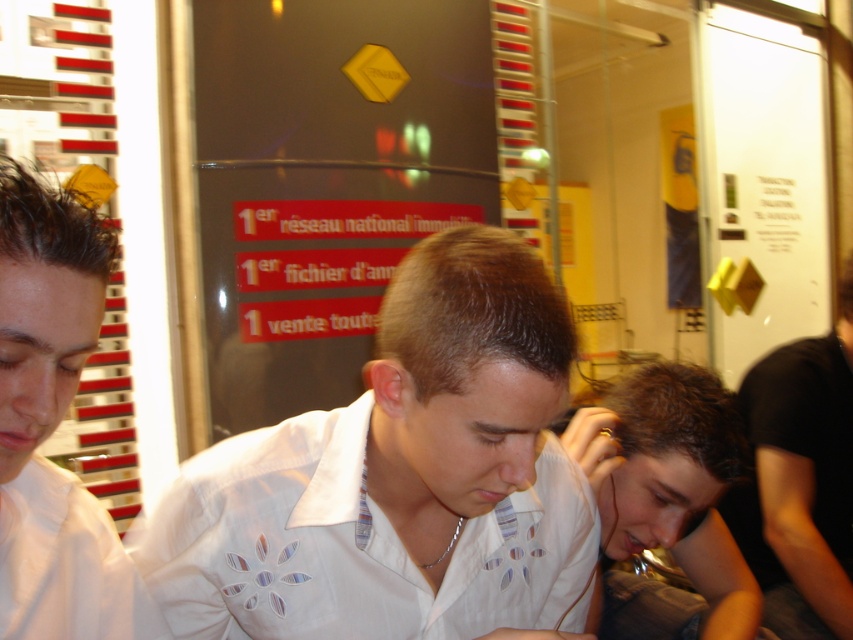
Question: Can you confirm if white fabric shirt at center is smaller than white matte shirt at left?

Choices:
 (A) no
 (B) yes

Answer: (A)

Question: Does white fabric shirt at center appear over black matte shirt at right?

Choices:
 (A) no
 (B) yes

Answer: (B)

Question: Can you confirm if dark brown hair at lower right is smaller than black matte shirt at right?

Choices:
 (A) yes
 (B) no

Answer: (A)

Question: Which object is the farthest from the white fabric shirt at center?

Choices:
 (A) black matte shirt at right
 (B) white matte shirt at left
 (C) dark brown hair at lower right

Answer: (A)

Question: Which object is closer to the camera taking this photo?

Choices:
 (A) white fabric shirt at center
 (B) black matte shirt at right
 (C) dark brown hair at lower right
 (D) white matte shirt at left

Answer: (D)

Question: Which object is the farthest from the white fabric shirt at center?

Choices:
 (A) white matte shirt at left
 (B) black matte shirt at right
 (C) dark brown hair at lower right

Answer: (B)